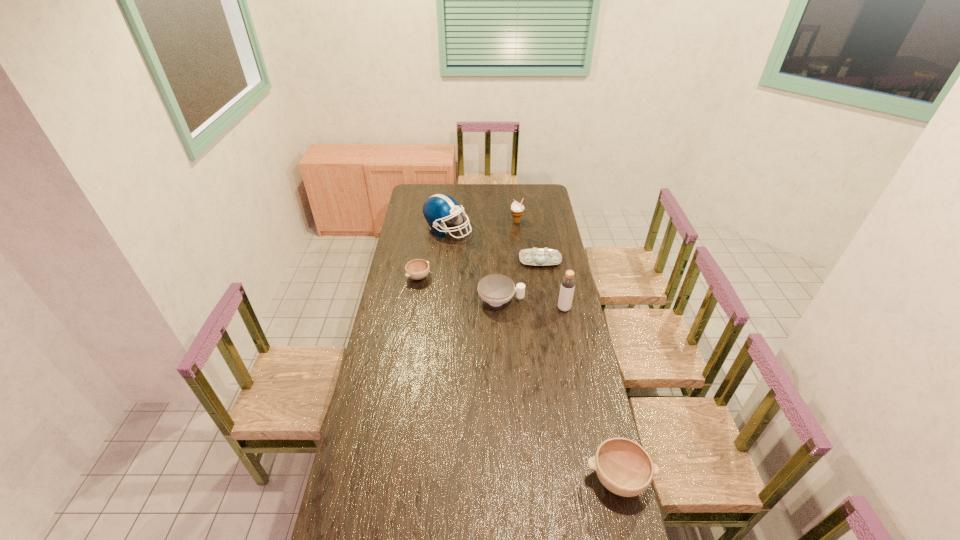
The width and height of the screenshot is (960, 540). Identify the location of vacant spot for a new bowl to ensure equal spacing. (497, 357).